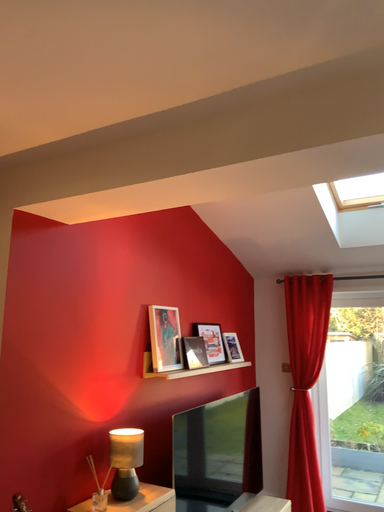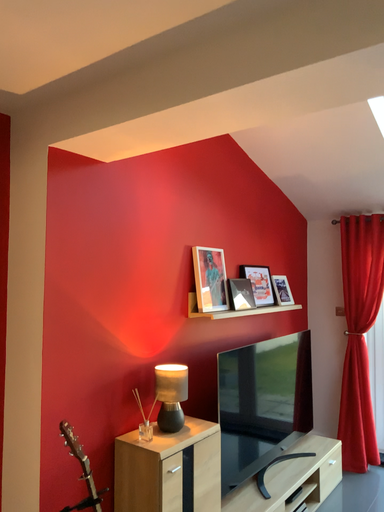
Question: How did the camera likely rotate when shooting the video?

Choices:
 (A) rotated left
 (B) rotated right

Answer: (A)